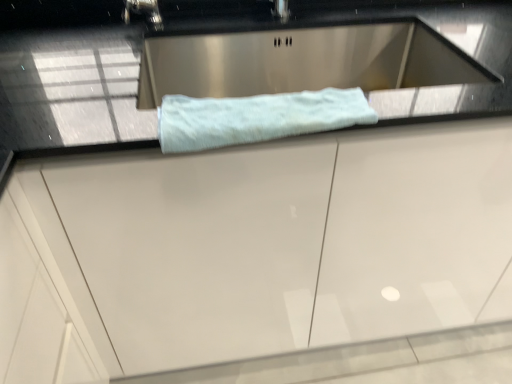
Question: Looking at the image, does white glossy cabinet at center seem bigger or smaller compared to light blue plush towel at center?

Choices:
 (A) big
 (B) small

Answer: (A)

Question: Considering the relative positions of white glossy cabinet at center and light blue plush towel at center in the image provided, is white glossy cabinet at center to the left or to the right of light blue plush towel at center?

Choices:
 (A) left
 (B) right

Answer: (B)

Question: From the image's perspective, is white glossy cabinet at center located above or below light blue plush towel at center?

Choices:
 (A) below
 (B) above

Answer: (A)

Question: In terms of size, does light blue plush towel at center appear bigger or smaller than white glossy cabinet at center?

Choices:
 (A) small
 (B) big

Answer: (A)

Question: Looking at their shapes, would you say light blue plush towel at center is wider or thinner than white glossy cabinet at center?

Choices:
 (A) thin
 (B) wide

Answer: (A)

Question: Considering the positions of light blue plush towel at center and white glossy cabinet at center in the image, is light blue plush towel at center taller or shorter than white glossy cabinet at center?

Choices:
 (A) tall
 (B) short

Answer: (B)

Question: Considering the relative positions of light blue plush towel at center and white glossy cabinet at center in the image provided, is light blue plush towel at center to the left or to the right of white glossy cabinet at center?

Choices:
 (A) right
 (B) left

Answer: (B)